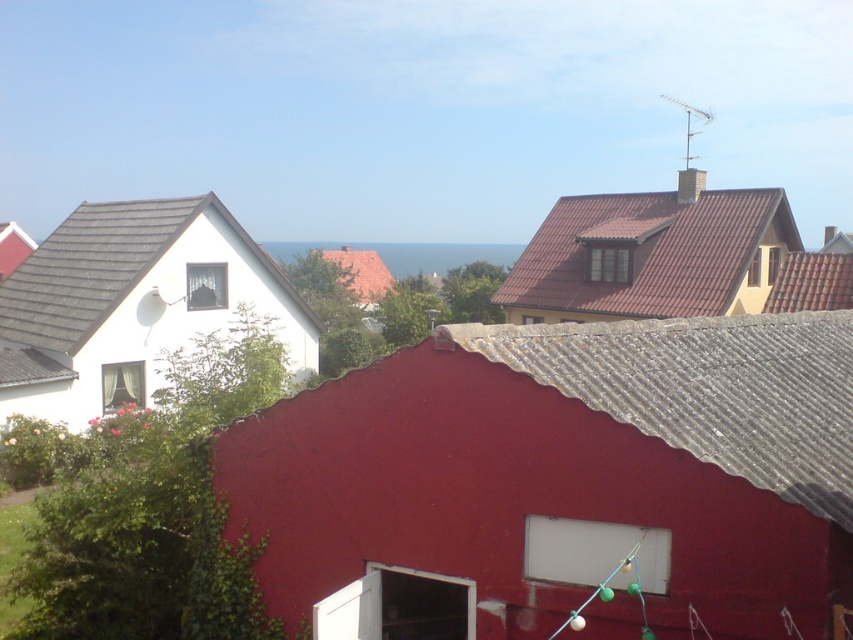
Question: Which object appears farthest from the camera in this image?

Choices:
 (A) red tile roof at center
 (B) gray shingles at left
 (C) brown tile roof at upper right

Answer: (A)

Question: Based on their relative distances, which object is farther from the gray shingles at left?

Choices:
 (A) brown tile roof at upper right
 (B) red tile roof at center

Answer: (B)

Question: Estimate the real-world distances between objects in this image. Which object is closer to the brown tile roof at upper right?

Choices:
 (A) gray shingles at left
 (B) red tile roof at center

Answer: (A)

Question: Does brown tile roof at upper right appear on the right side of gray shingles at left?

Choices:
 (A) yes
 (B) no

Answer: (A)

Question: Is gray shingles at left positioned at the back of red tile roof at center?

Choices:
 (A) no
 (B) yes

Answer: (A)

Question: Is gray shingles at left to the right of red tile roof at center from the viewer's perspective?

Choices:
 (A) no
 (B) yes

Answer: (A)